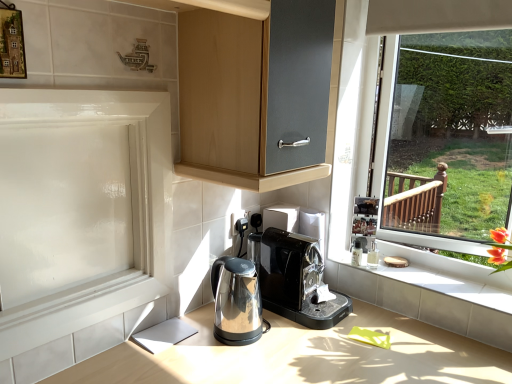
Question: Can you confirm if white tile at lower right is positioned to the left of satin metallic countertop at center?

Choices:
 (A) yes
 (B) no

Answer: (B)

Question: Is white tile at lower right smaller than satin metallic countertop at center?

Choices:
 (A) no
 (B) yes

Answer: (B)

Question: Does white tile at lower right have a lesser width compared to satin metallic countertop at center?

Choices:
 (A) no
 (B) yes

Answer: (B)

Question: Is white tile at lower right taller than satin metallic countertop at center?

Choices:
 (A) yes
 (B) no

Answer: (B)

Question: From the image's perspective, is white tile at lower right below satin metallic countertop at center?

Choices:
 (A) no
 (B) yes

Answer: (A)

Question: Are white tile at lower right and satin metallic countertop at center located far from each other?

Choices:
 (A) yes
 (B) no

Answer: (B)

Question: Is satin metallic countertop at center to the left of white glossy screen door at left from the viewer's perspective?

Choices:
 (A) yes
 (B) no

Answer: (B)

Question: Is satin metallic countertop at center thinner than white glossy screen door at left?

Choices:
 (A) yes
 (B) no

Answer: (B)

Question: From a real-world perspective, is satin metallic countertop at center located higher than white glossy screen door at left?

Choices:
 (A) yes
 (B) no

Answer: (B)

Question: Is satin metallic countertop at center directly adjacent to white glossy screen door at left?

Choices:
 (A) no
 (B) yes

Answer: (A)

Question: Would you say satin metallic countertop at center contains white glossy screen door at left?

Choices:
 (A) yes
 (B) no

Answer: (B)

Question: Is satin metallic countertop at center further to camera compared to white glossy screen door at left?

Choices:
 (A) no
 (B) yes

Answer: (B)

Question: From the image's perspective, would you say stainless steel kettle at lower center, placed as the first home appliance when sorted from left to right, is shown under white glossy screen door at left?

Choices:
 (A) no
 (B) yes

Answer: (B)